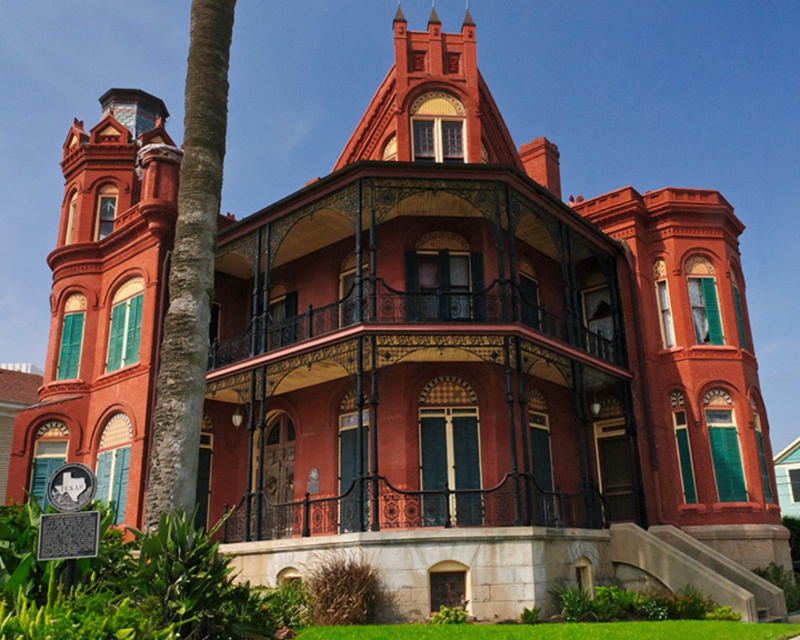
You are standing in front of the Victorian house and want to take a photo of both the matte red balcony at center and the polished wrought iron porch at center. Which object should you position to your left to include both in the frame?

The matte red balcony at center is to the right of the polished wrought iron porch at center, so you should position the polished wrought iron porch at center to your left to include both in the frame.

You are standing in front of the Victorian house and want to place a large potted plant on the polished wrought iron porch at center. However, there is already an object on the matte red balcony at center. Can the potted plant be placed on the porch without obstructing the balcony?

The matte red balcony at center is above the polished wrought iron porch at center, so placing the potted plant on the porch will not obstruct the balcony since they are at different heights.